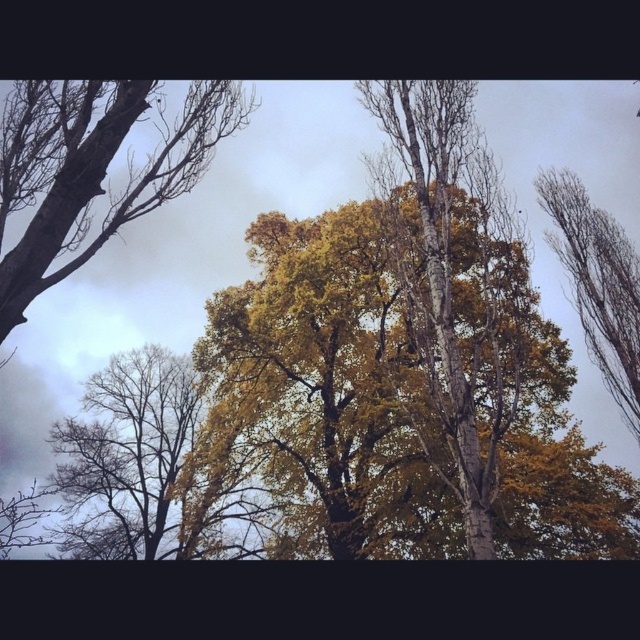
You are standing in a forest and see the smooth bark tree at upper left and the bare branches at upper right. Which one is positioned higher in the scene?

The smooth bark tree at upper left is positioned higher than the bare branches at upper right.

You are a bird looking for a nesting spot. You see the smooth bark tree at upper left and the bare branches at upper right. Which tree has a taller structure for nesting?

The smooth bark tree at upper left has a greater height compared to the bare branches at upper right, so it is taller and suitable for nesting.

You are standing at the point marked as point (93, 168) in the image. Looking around, you see a smooth bark tree at upper left and other trees with rough textures. Which tree has a smoother bark based on your current position?

The smooth bark tree at upper left has a smoother bark compared to the other trees with rough textures in the scene.